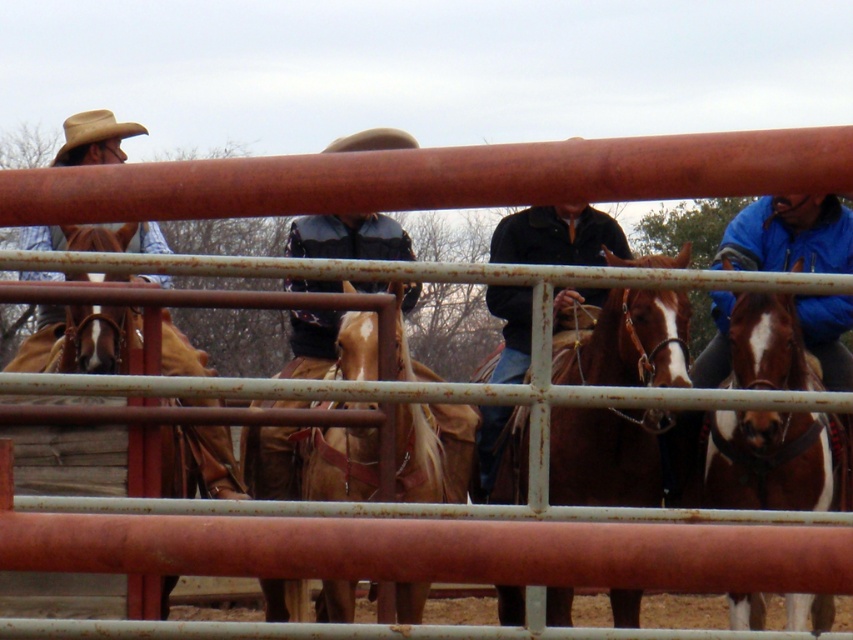
Who is more forward, (x=337, y=257) or (x=503, y=307)?

Positioned in front is point (x=503, y=307).

Is point (283, 378) closer to camera compared to point (524, 225)?

That is True.

Is point (281, 458) positioned in front of point (495, 314)?

That is True.

Locate an element on the screen. Image resolution: width=853 pixels, height=640 pixels. leather jacket at center is located at coordinates (347, 237).

Is light brown leather horse at center positioned in front of rustic leather cowboy hat at upper left?

Yes, it is.

How much distance is there between light brown leather horse at center and rustic leather cowboy hat at upper left?

The distance of light brown leather horse at center from rustic leather cowboy hat at upper left is 7.69 feet.

Is point (442, 444) farther from camera compared to point (68, 145)?

That is False.

Identify the location of light brown leather horse at center. The height and width of the screenshot is (640, 853). (312, 461).

Can you confirm if light brown leather horse at center is thinner than leather jacket at center?

No.

Can you confirm if light brown leather horse at center is positioned above leather jacket at center?

Incorrect, light brown leather horse at center is not positioned above leather jacket at center.

Who is more forward, (397, 582) or (325, 248)?

Point (397, 582) is in front.

Locate an element on the screen. light brown leather horse at center is located at coordinates (312, 461).